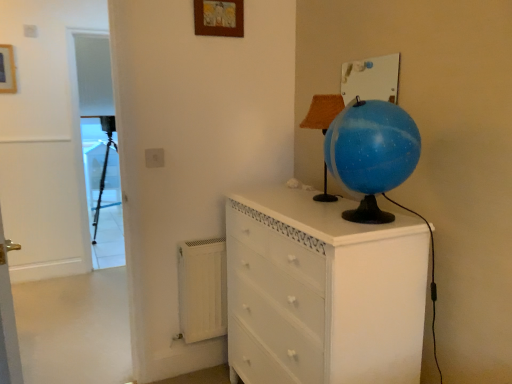
Question: Can you confirm if white matte radiator at lower left is smaller than white painted wood chest of drawers at center?

Choices:
 (A) no
 (B) yes

Answer: (B)

Question: Is white matte radiator at lower left bigger than white painted wood chest of drawers at center?

Choices:
 (A) yes
 (B) no

Answer: (B)

Question: Is white matte radiator at lower left positioned beyond the bounds of white painted wood chest of drawers at center?

Choices:
 (A) yes
 (B) no

Answer: (A)

Question: Can you confirm if white matte radiator at lower left is taller than white painted wood chest of drawers at center?

Choices:
 (A) no
 (B) yes

Answer: (A)

Question: Is white matte radiator at lower left wider than white painted wood chest of drawers at center?

Choices:
 (A) yes
 (B) no

Answer: (B)

Question: Is white painted wood chest of drawers at center inside or outside of wooden picture frame at upper center, the second picture frame from the left?

Choices:
 (A) outside
 (B) inside

Answer: (A)

Question: From their relative heights in the image, would you say white painted wood chest of drawers at center is taller or shorter than wooden picture frame at upper center, the second picture frame from the left?

Choices:
 (A) tall
 (B) short

Answer: (A)

Question: From the image's perspective, is white painted wood chest of drawers at center located above or below wooden picture frame at upper center, the 1th picture frame in the front-to-back sequence?

Choices:
 (A) above
 (B) below

Answer: (B)

Question: Is white painted wood chest of drawers at center to the left or to the right of wooden picture frame at upper center, the 1th picture frame in the front-to-back sequence, in the image?

Choices:
 (A) right
 (B) left

Answer: (A)

Question: Considering the positions of point (372, 147) and point (2, 66), is point (372, 147) closer or farther from the camera than point (2, 66)?

Choices:
 (A) closer
 (B) farther

Answer: (A)

Question: Is blue glossy globe at upper right inside the boundaries of wooden picture frame at upper left, which is the 2th picture frame in right-to-left order, or outside?

Choices:
 (A) outside
 (B) inside

Answer: (A)

Question: From a real-world perspective, is blue glossy globe at upper right physically located above or below wooden picture frame at upper left, which is the 2th picture frame in right-to-left order?

Choices:
 (A) below
 (B) above

Answer: (A)

Question: In terms of size, does blue glossy globe at upper right appear bigger or smaller than wooden picture frame at upper left, which is counted as the first picture frame, starting from the left?

Choices:
 (A) small
 (B) big

Answer: (B)

Question: From the image's perspective, is matte black tripod at left located above or below wooden picture frame at upper center, which is the first picture frame in right-to-left order?

Choices:
 (A) below
 (B) above

Answer: (A)

Question: From a real-world perspective, is matte black tripod at left above or below wooden picture frame at upper center, which is the first picture frame in right-to-left order?

Choices:
 (A) below
 (B) above

Answer: (A)